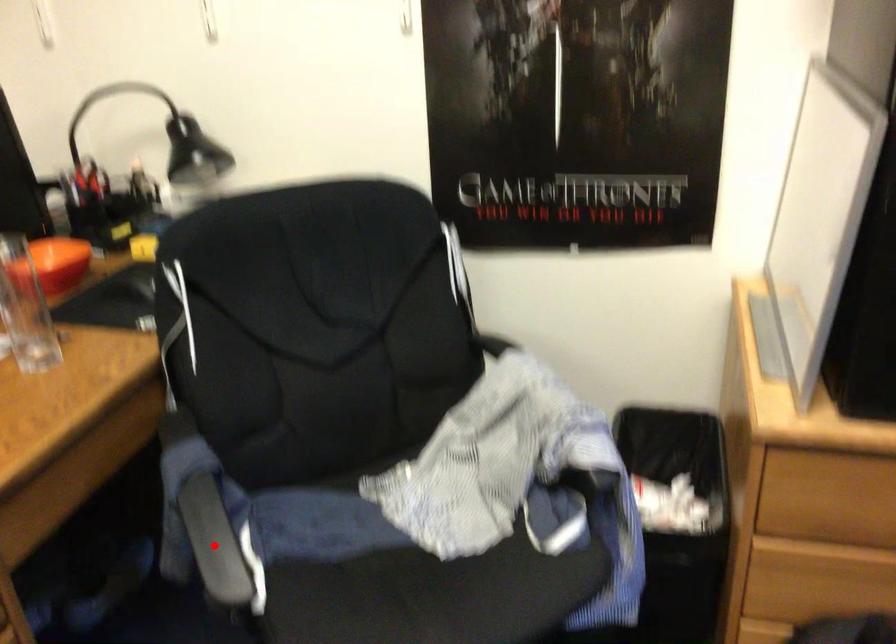
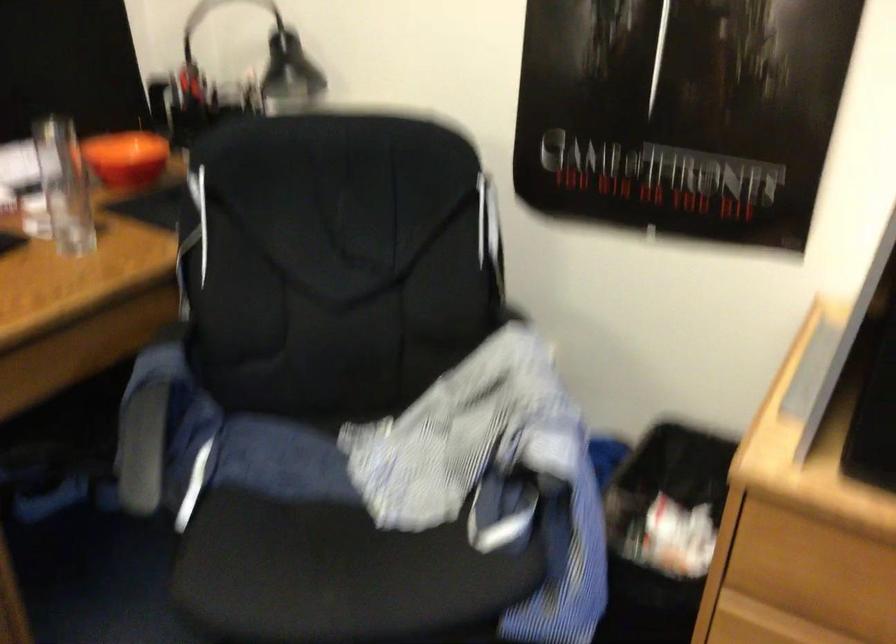
Find the pixel in the second image that matches the highlighted location in the first image.

(142, 448)